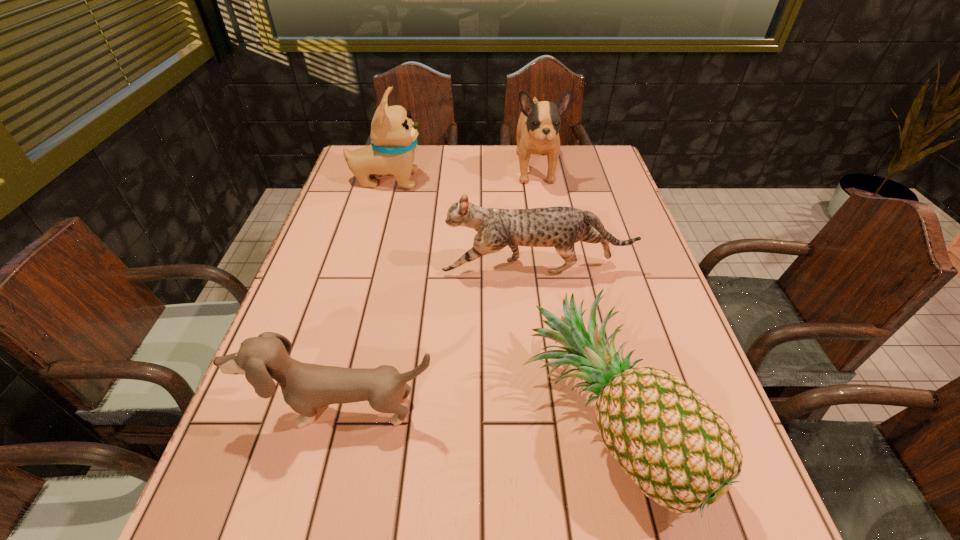
This screenshot has height=540, width=960. Identify the location of object situated at the near edge. (677, 448).

At what (x,y) coordinates should I click in order to perform the action: click on cat located in the right edge section of the desktop. Please return your answer as a coordinate pair (x, y). This screenshot has height=540, width=960. Looking at the image, I should click on (560, 227).

This screenshot has width=960, height=540. I want to click on pineapple at the right edge, so click(x=677, y=448).

Where is `object situated at the far left corner`? This screenshot has width=960, height=540. object situated at the far left corner is located at coordinates (393, 134).

The width and height of the screenshot is (960, 540). I want to click on object positioned at the near right corner, so click(677, 448).

Find the location of a particular element. vacant space at the far edge is located at coordinates (482, 157).

This screenshot has height=540, width=960. What are the coordinates of `vacant region at the left edge` in the screenshot? It's located at (332, 281).

This screenshot has height=540, width=960. Find the location of `vacant point at the right edge`. vacant point at the right edge is located at coordinates (606, 222).

Locate an element on the screen. Image resolution: width=960 pixels, height=540 pixels. vacant space in between the pineapple and the nearest puppy is located at coordinates (473, 415).

Identify the location of free spot between the third farthest object and the nearest puppy. (440, 339).